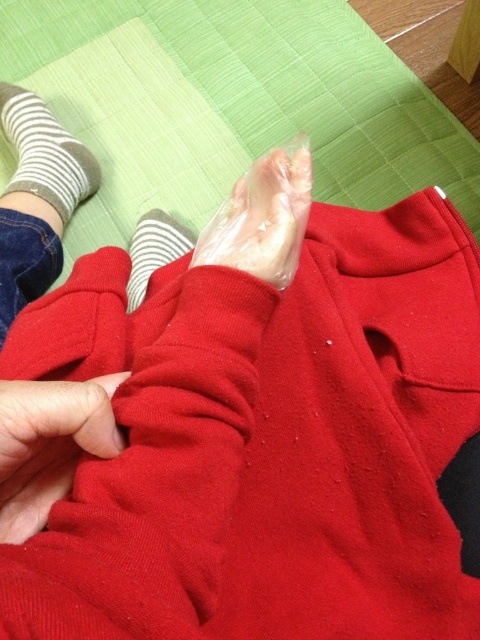
Question: Does transparent plastic foot at center appear under white striped sock at lower left?

Choices:
 (A) no
 (B) yes

Answer: (B)

Question: Which point is farther from the camera taking this photo?

Choices:
 (A) (144, 289)
 (B) (235, 241)

Answer: (A)

Question: Which point appears closest to the camera in this image?

Choices:
 (A) (60, 140)
 (B) (151, 220)
 (C) (296, 237)

Answer: (C)

Question: Can you confirm if white striped sock at lower left is thinner than white striped sock at upper left?

Choices:
 (A) no
 (B) yes

Answer: (A)

Question: Considering the real-world distances, which object is farthest from the white striped sock at lower left?

Choices:
 (A) transparent plastic foot at center
 (B) white striped sock at upper left

Answer: (A)

Question: Can you confirm if white striped sock at lower left is positioned to the right of white striped sock at upper left?

Choices:
 (A) yes
 (B) no

Answer: (B)